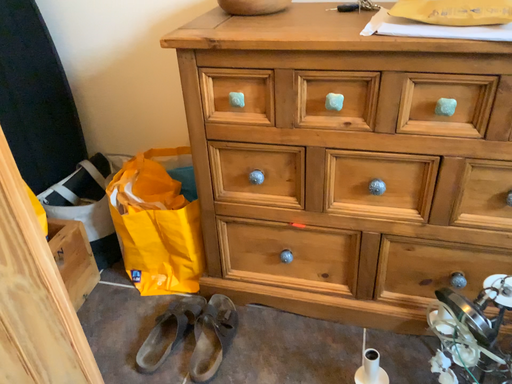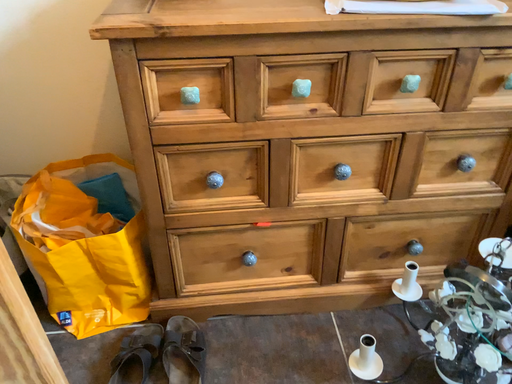
Question: How did the camera likely rotate when shooting the video?

Choices:
 (A) rotated left
 (B) rotated right

Answer: (B)